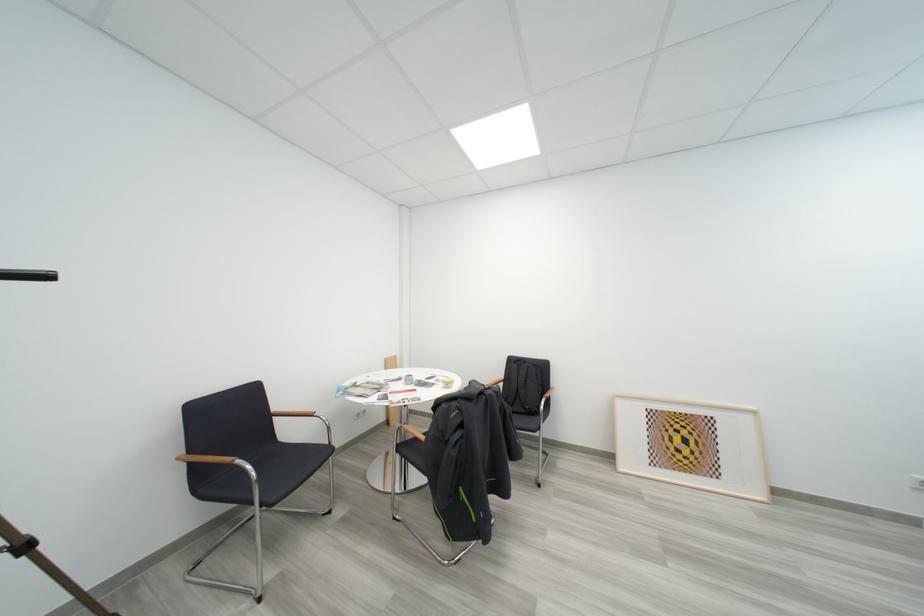
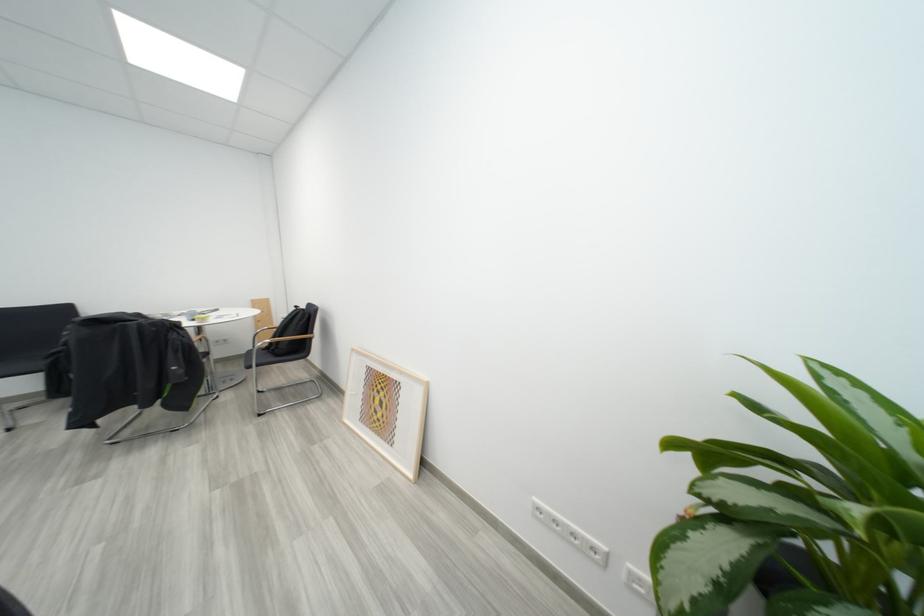
Question: The images are taken continuously from a first-person perspective. In which direction are you moving?

Choices:
 (A) Left
 (B) Right
 (C) Forward
 (D) Backward

Answer: (B)